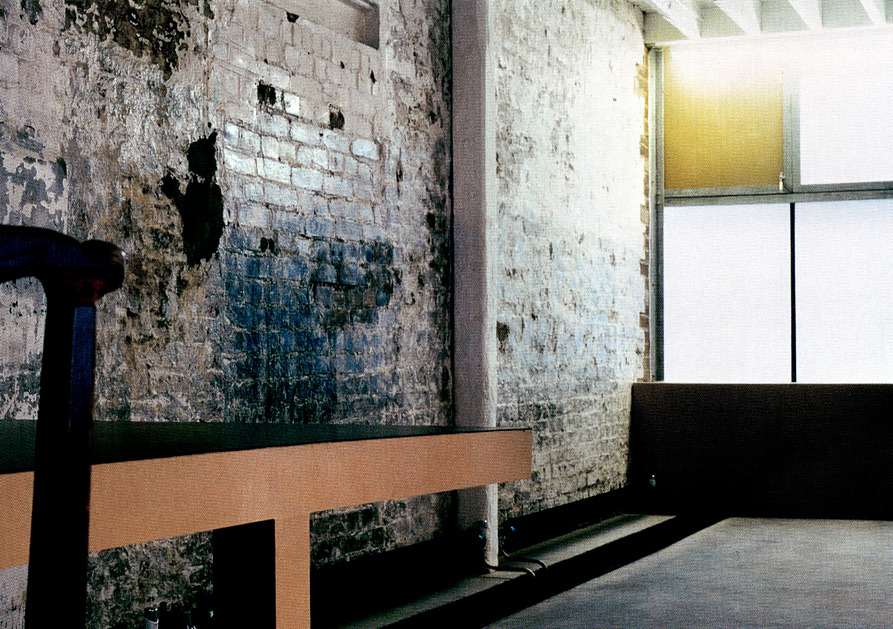
At what (x,y) coordinates should I click in order to perform the action: click on translucent white panels. Please return your answer as a coordinate pair (x, y). This screenshot has width=893, height=629. Looking at the image, I should click on (731, 307), (846, 308), (853, 109).